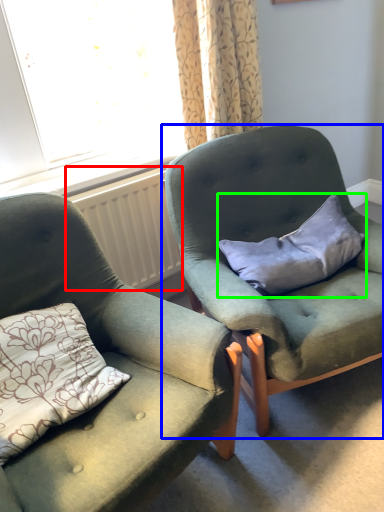
Question: Estimate the real-world distances between objects in this image. Which object is closer to radiator (highlighted by a red box), chair (highlighted by a blue box) or pillow (highlighted by a green box)?

Choices:
 (A) chair
 (B) pillow

Answer: (A)